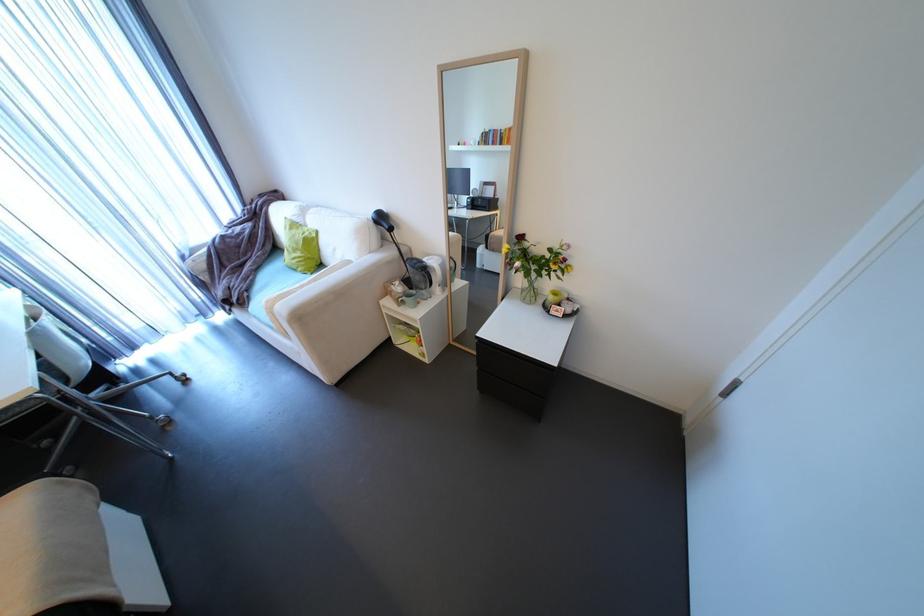
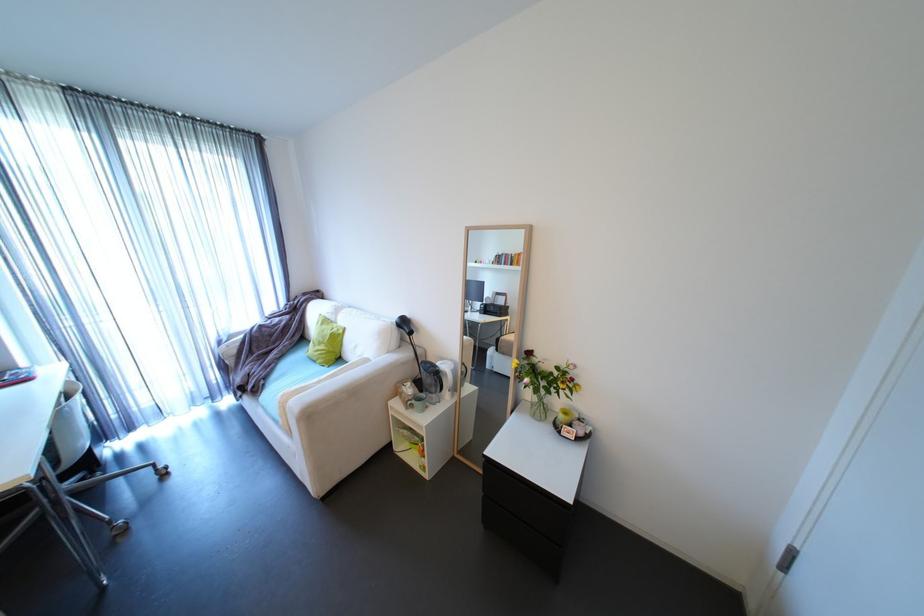
Question: Based on the continuous images, in which direction is the camera rotating? Reply with the corresponding letter.

Choices:
 (A) Left
 (B) Right
 (C) Up
 (D) Down

Answer: (C)